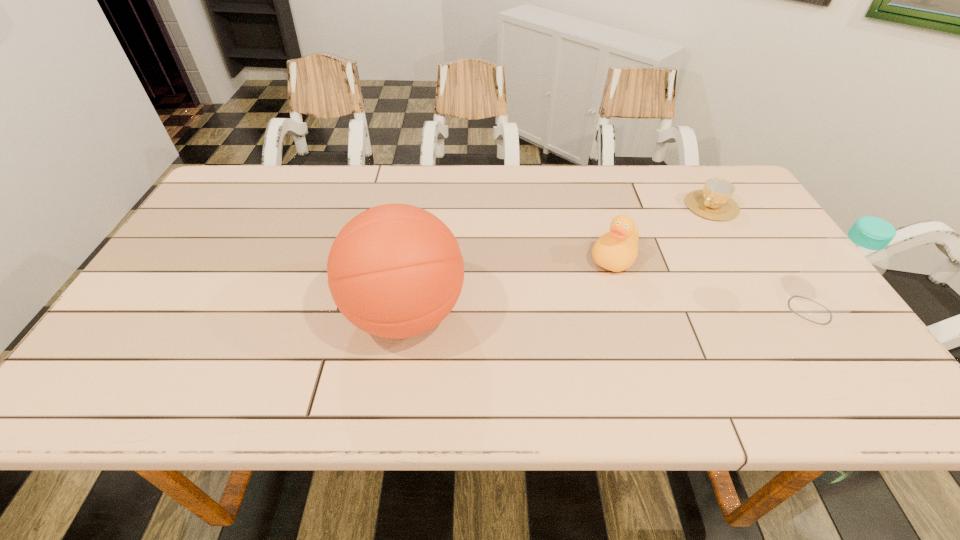
Where is `vacant spot on the desktop that is between the basketball and the bottle and is positioned with the handle on the side of the cup`? The image size is (960, 540). vacant spot on the desktop that is between the basketball and the bottle and is positioned with the handle on the side of the cup is located at coordinates (588, 312).

The height and width of the screenshot is (540, 960). Find the location of `vacant spot on the desktop that is between the leftmost object and the bottle and is positioned on the face of the third object from right to left`. vacant spot on the desktop that is between the leftmost object and the bottle and is positioned on the face of the third object from right to left is located at coordinates (581, 312).